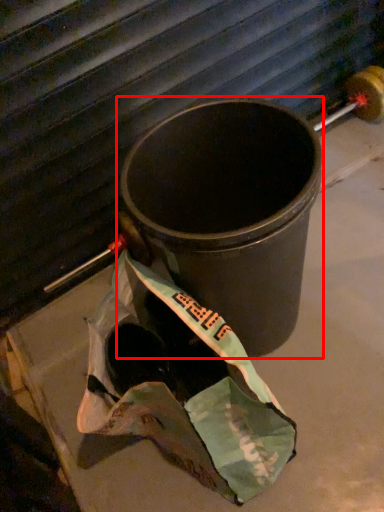
Question: From the image's perspective, what is the correct spatial positioning of waste container (annotated by the red box) in reference to grocery bag?

Choices:
 (A) above
 (B) below

Answer: (A)